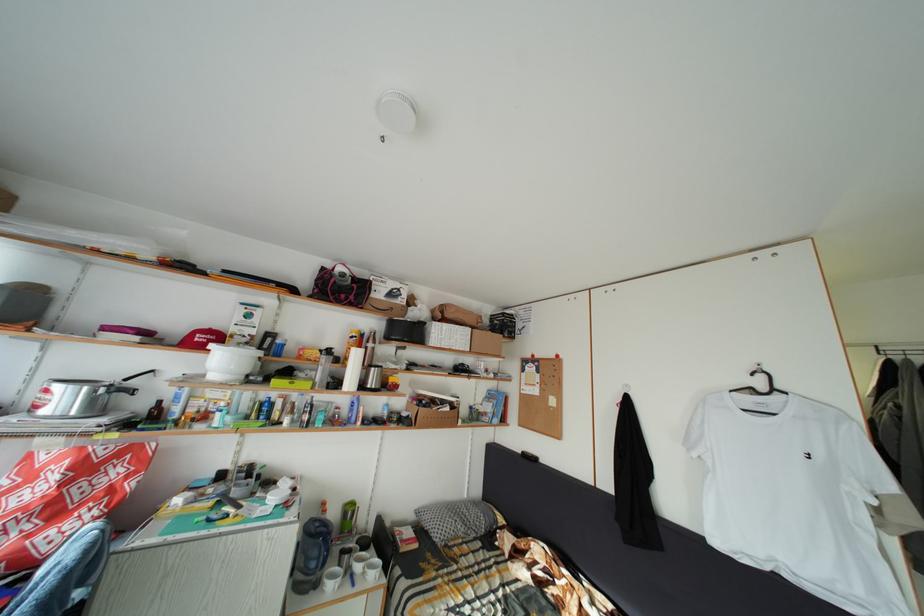
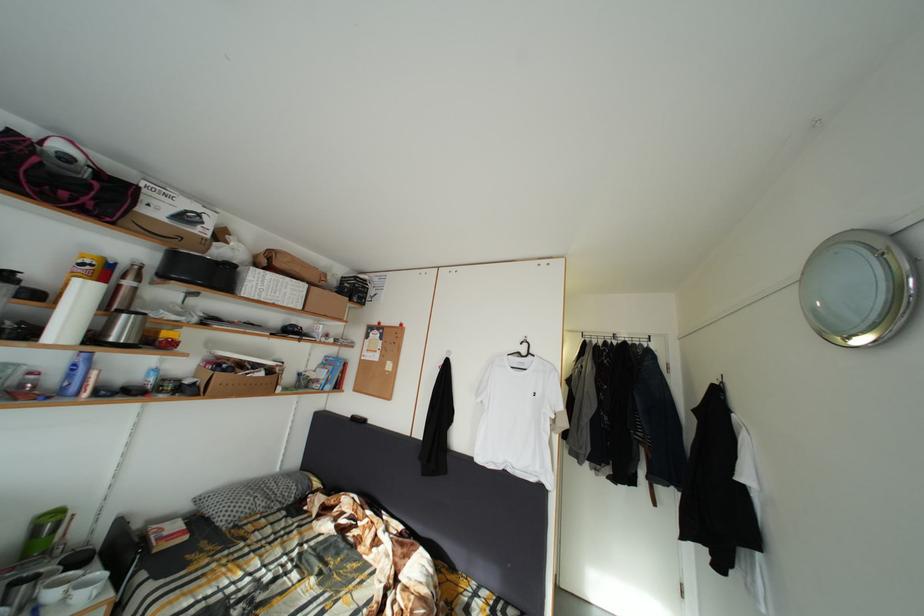
Question: I am providing you with two images of the same scene from different viewpoints. Please identify which objects are invisible in image2.

Choices:
 (A) blue plastic bottle
 (B) metal wall hook
 (C) black pot lid handle
 (D) none of these

Answer: (D)